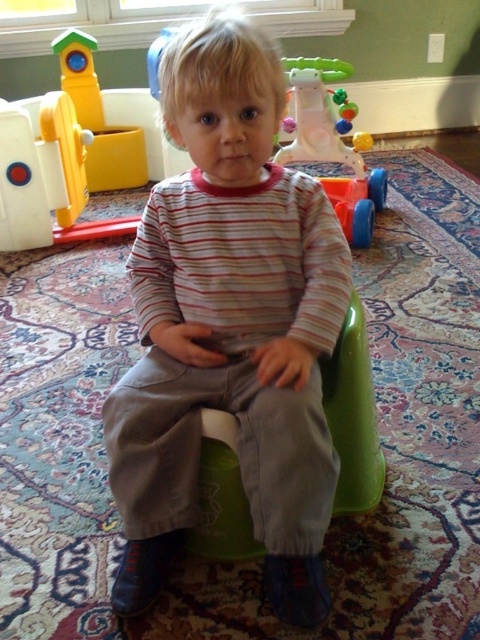
Question: Does matte plastic walker at upper center have a smaller size compared to plastic walker at upper center?

Choices:
 (A) no
 (B) yes

Answer: (A)

Question: Can you confirm if matte plastic walker at upper center is wider than green plastic chair at center?

Choices:
 (A) no
 (B) yes

Answer: (B)

Question: Estimate the real-world distances between objects in this image. Which object is farther from the green plastic chair at center?

Choices:
 (A) matte plastic walker at upper center
 (B) matte striped shirt at center
 (C) plastic walker at upper center

Answer: (A)

Question: Which object is farther from the camera taking this photo?

Choices:
 (A) matte plastic walker at upper center
 (B) green plastic chair at center

Answer: (A)

Question: Can you confirm if matte striped shirt at center is positioned above matte plastic walker at upper center?

Choices:
 (A) no
 (B) yes

Answer: (A)

Question: Which of the following is the closest to the observer?

Choices:
 (A) plastic walker at upper center
 (B) matte striped shirt at center
 (C) green plastic chair at center
 (D) matte plastic walker at upper center

Answer: (B)